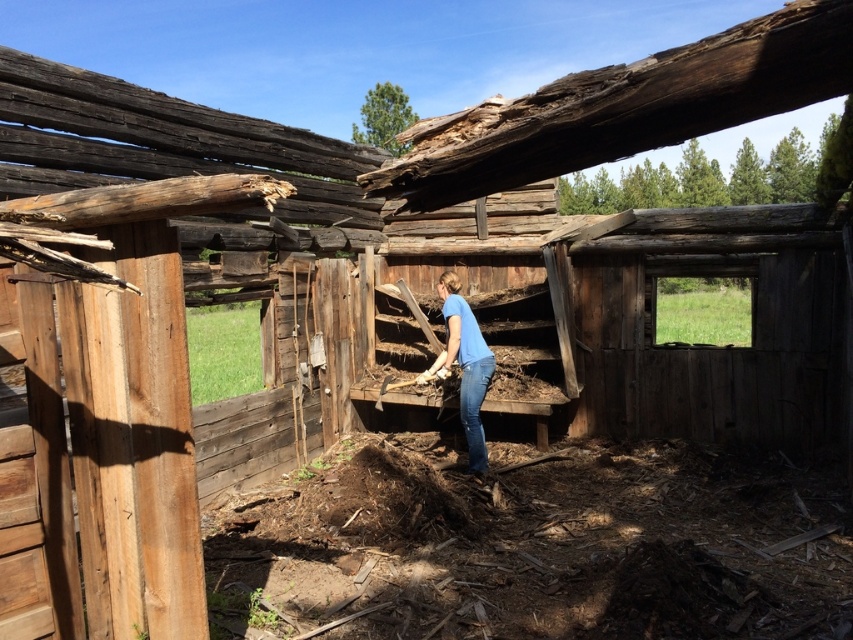
You are a safety inspector checking the structure. You notice the blue cotton shirt at center and blue denim jeans at center. Which clothing item is wider when viewed from the front?

The blue cotton shirt at center might be wider than blue denim jeans at center when viewed from the front.

You are navigating through the debris inside the rustic wooden structure. You need to reach the blue cotton shirt at center to hand over a tool. Given the coordinates provided, can you determine if the shirt is positioned closer to the collapsed roof area or the stable wall section?

The blue cotton shirt at center is located at point (463, 365). Since the coordinates indicate it is near the center of the image, it is likely positioned closer to the stable wall section rather than the collapsed roof area.

From the picture: You are a safety inspector entering the building and notice the blue cotton shirt at center and the blue denim jeans at center. Which item is closer to you as you approach the center of the room?

The blue cotton shirt at center is closer to you because it is in front of the blue denim jeans at center.